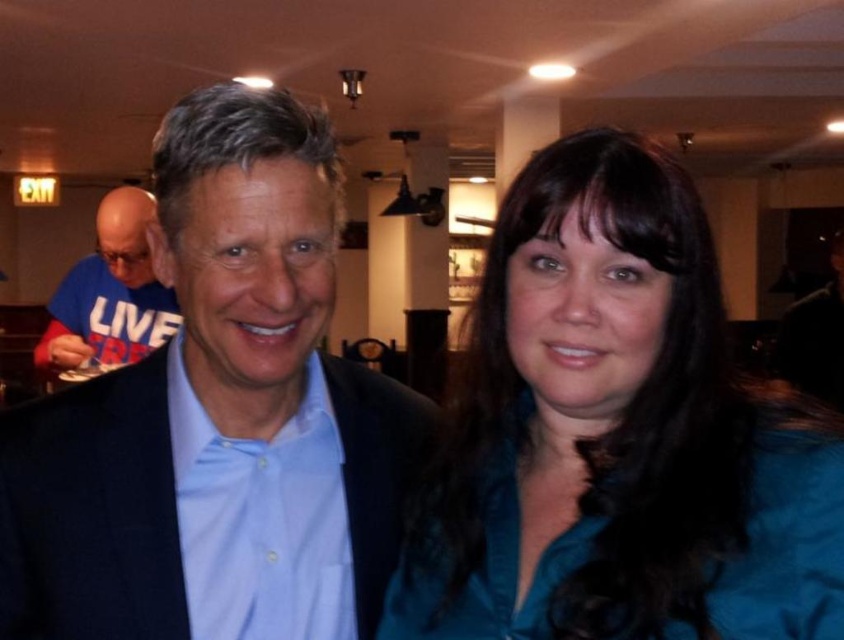
You are standing in a room and want to reach a point that is 23.09 inches away from you. There is a point marked at coordinates point (603,628). Can you determine if this point is the one you need to reach?

The point (603,628) is exactly 23.09 inches away from the viewer, so yes, this is the point you need to reach.

You are at a social event and want to take a photo of both the man and the woman in the image. The man is at point (166,244) and the woman is at point (155,340). To ensure both are in the frame without any obstruction, which person should you position closer to the camera?

You should position the man at point (166,244) closer to the camera because he is in front of the woman at point (155,340) according to their coordinates.